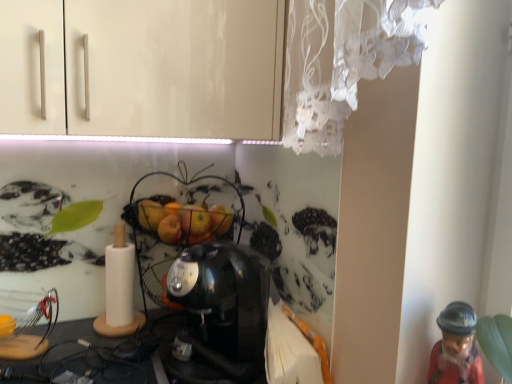
Question: Considering the positions of satin black coffee maker at center and metallic wire basket at center in the image, is satin black coffee maker at center taller or shorter than metallic wire basket at center?

Choices:
 (A) tall
 (B) short

Answer: (B)

Question: From a real-world perspective, is satin black coffee maker at center physically located above or below metallic wire basket at center?

Choices:
 (A) above
 (B) below

Answer: (B)

Question: Which object is positioned farthest from the metallic wire basket at center?

Choices:
 (A) red glossy figurine at lower right
 (B) satin black coffee maker at center

Answer: (A)

Question: Which object is positioned closest to the satin black coffee maker at center?

Choices:
 (A) red glossy figurine at lower right
 (B) metallic wire basket at center

Answer: (B)